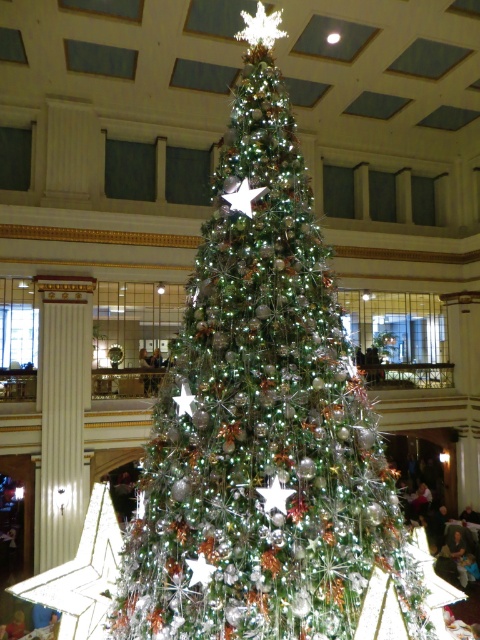
Between iridescent metallic christmas tree at center and metallic silver star at center, which one appears on the right side from the viewer's perspective?

iridescent metallic christmas tree at center is more to the right.

Measure the distance between iridescent metallic christmas tree at center and camera.

They are 2.05 meters apart.

I want to click on iridescent metallic christmas tree at center, so click(x=263, y=420).